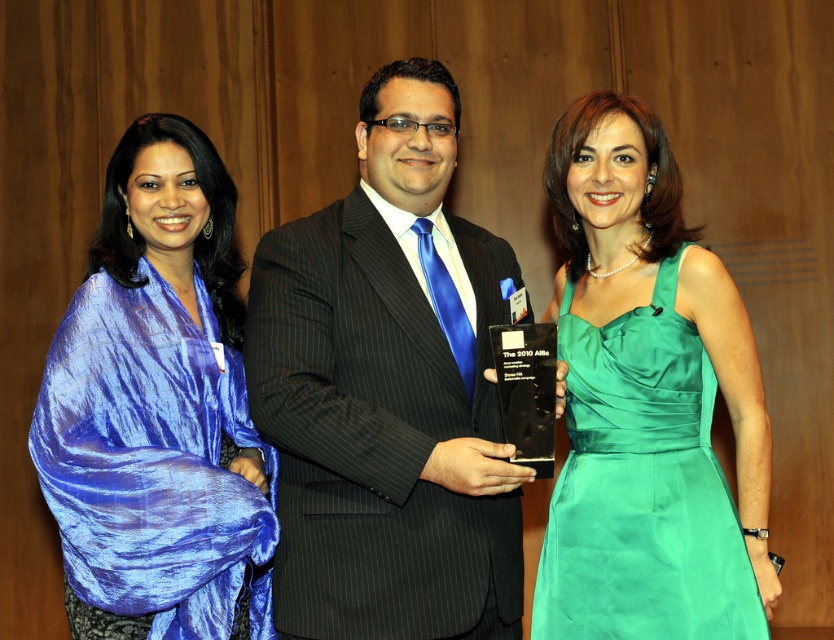
Which is above, matte black suit at center or blue silk scarf at left?

matte black suit at center is higher up.

Does point (506, 589) come closer to viewer compared to point (169, 556)?

No.

Is point (335, 333) closer to viewer compared to point (78, 509)?

No, it is behind (78, 509).

Where is `matte black suit at center`? matte black suit at center is located at coordinates (388, 390).

Does matte black suit at center appear under emerald satin dress at center?

Incorrect, matte black suit at center is not positioned below emerald satin dress at center.

Looking at this image, can you confirm if matte black suit at center is taller than emerald satin dress at center?

Correct, matte black suit at center is much taller as emerald satin dress at center.

Image resolution: width=834 pixels, height=640 pixels. What do you see at coordinates (388, 390) in the screenshot?
I see `matte black suit at center` at bounding box center [388, 390].

You are a GUI agent. You are given a task and a screenshot of the screen. Output one action in this format:
    pyautogui.click(x=<x>, y=<y>)
    Task: Click on the matte black suit at center
    This screenshot has height=640, width=834.
    Given the screenshot: What is the action you would take?
    pyautogui.click(x=388, y=390)

This screenshot has width=834, height=640. What do you see at coordinates (158, 404) in the screenshot?
I see `blue silk scarf at left` at bounding box center [158, 404].

Between point (104, 339) and point (570, 536), which one is positioned in front?

Positioned in front is point (104, 339).

Between point (143, 577) and point (661, 285), which one is positioned in front?

Point (143, 577)

The image size is (834, 640). I want to click on blue silk scarf at left, so click(x=158, y=404).